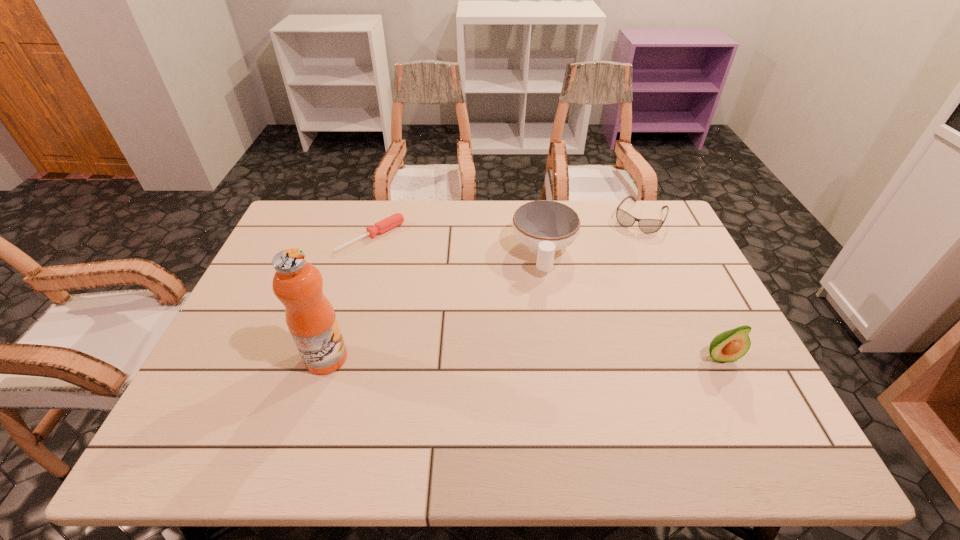
Identify the location of free region located 0.180m at the tip of the shortest object. The height and width of the screenshot is (540, 960). (425, 279).

Where is `vacant space located 0.310m on the side with the handle of the third shortest object`? This screenshot has width=960, height=540. vacant space located 0.310m on the side with the handle of the third shortest object is located at coordinates (544, 370).

Find the location of `free space located on the side with the handle of the third shortest object`. free space located on the side with the handle of the third shortest object is located at coordinates (544, 380).

You are a GUI agent. You are given a task and a screenshot of the screen. Output one action in this format:
    pyautogui.click(x=<x>, y=<y>)
    Task: Click on the blank space located 0.090m on the side with the handle of the third shortest object
    The height and width of the screenshot is (540, 960).
    Given the screenshot: What is the action you would take?
    pyautogui.click(x=545, y=303)

Find the location of a particular element. Image resolution: width=960 pixels, height=540 pixels. vacant space located 0.390m on the lenses of the second shortest object is located at coordinates (594, 309).

Where is `vacant space situated on the lenses of the second shortest object`? The height and width of the screenshot is (540, 960). vacant space situated on the lenses of the second shortest object is located at coordinates (611, 276).

Locate an element on the screen. The width and height of the screenshot is (960, 540). vacant space located 0.320m on the lenses of the second shortest object is located at coordinates (602, 294).

Locate an element on the screen. This screenshot has width=960, height=540. screwdriver that is at the far edge is located at coordinates (396, 219).

In order to click on chinaware that is at the far edge in this screenshot , I will do `click(544, 226)`.

In order to click on sunglasses positioned at the far edge in this screenshot , I will do `click(648, 226)`.